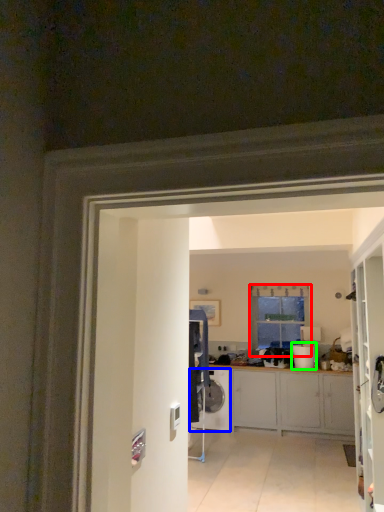
Question: Based on their relative distances, which object is farther from window (highlighted by a red box)? Choose from washing machine (highlighted by a blue box) and appliance (highlighted by a green box).

Choices:
 (A) washing machine
 (B) appliance

Answer: (A)